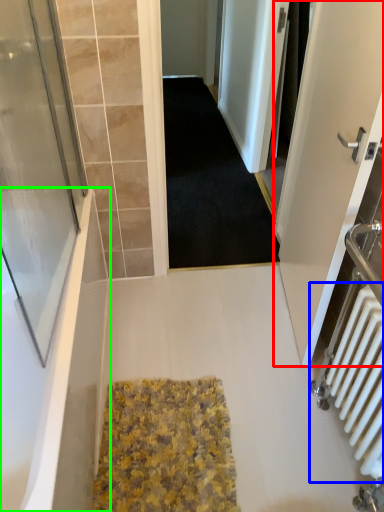
Question: Which object is the farthest from door (highlighted by a red box)? Choose among these: radiator (highlighted by a blue box) or bathtub (highlighted by a green box).

Choices:
 (A) radiator
 (B) bathtub

Answer: (B)